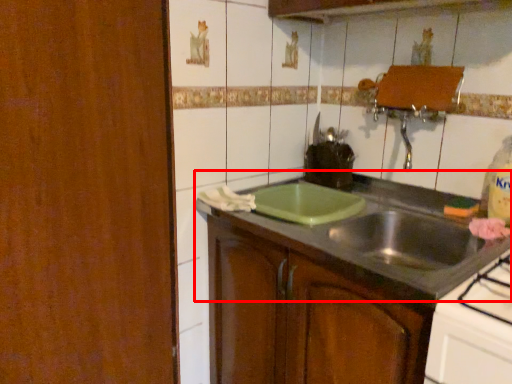
Question: From the image's perspective, considering the relative positions of countertop (annotated by the red box) and cabinetry in the image provided, where is countertop (annotated by the red box) located with respect to the staircase?

Choices:
 (A) above
 (B) below

Answer: (A)